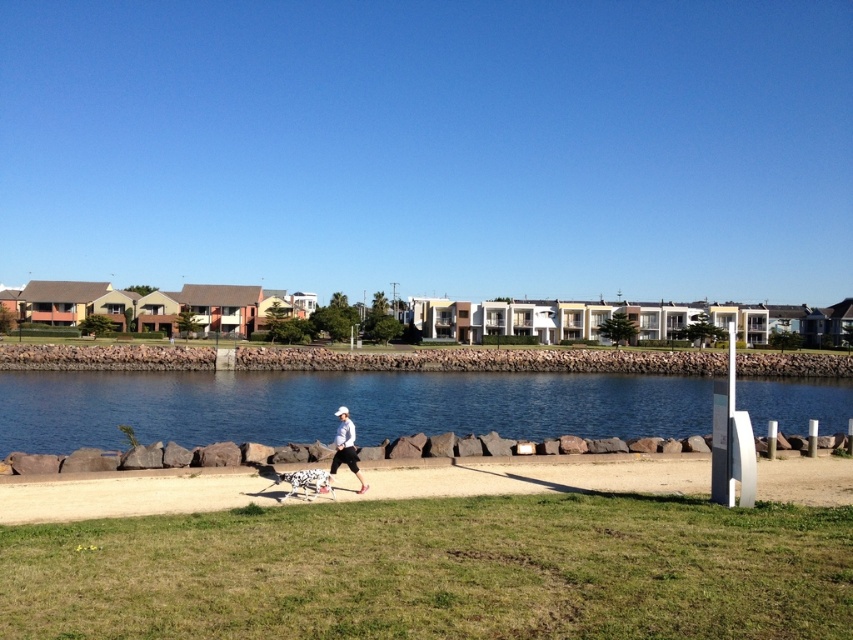
You are standing at the point with coordinates point (20, 410) and want to walk to the point with coordinates point (337, 449). Given the riverside path runs parallel to the riverbank, which direction should you head to reach your destination?

Since point (20, 410) is behind point (337, 449), you should walk forward along the riverside path towards the direction of the residential buildings to reach your destination.

You are a photographer planning to take a wide shot of the scene. The blue stone water at center and the white matte jacket at center are both in your frame. Which object will occupy more of the frame?

The blue stone water at center is larger in size than the white matte jacket at center, so it will occupy more of the frame.